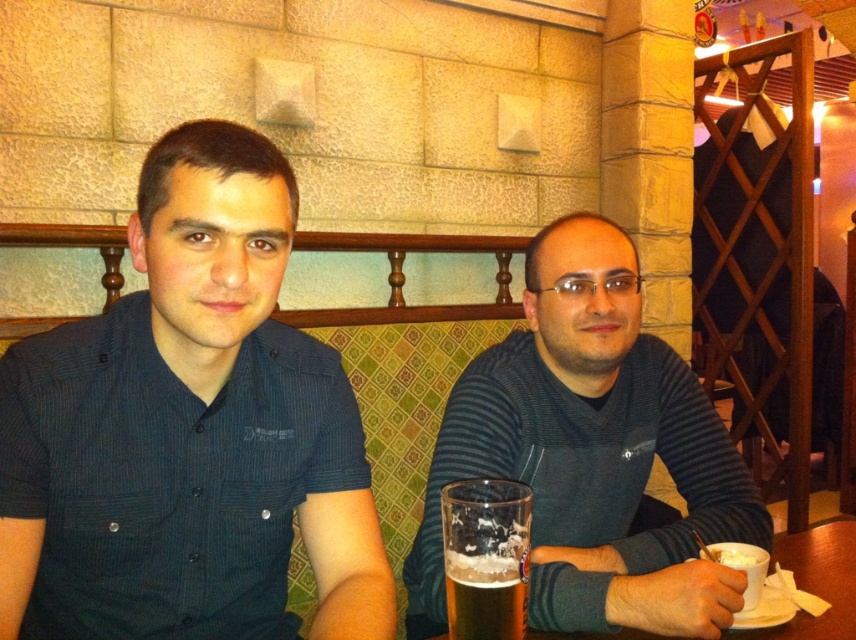
Question: Is foamy golden beer at lower center above foamy glass beer at lower center?

Choices:
 (A) yes
 (B) no

Answer: (A)

Question: Estimate the real-world distances between objects in this image. Which object is closer to the dark gray sweater at center?

Choices:
 (A) foamy glass beer at lower center
 (B) foamy golden beer at lower center

Answer: (B)

Question: Can you confirm if dark gray sweater at center is positioned above wooden table at lower center?

Choices:
 (A) yes
 (B) no

Answer: (A)

Question: Estimate the real-world distances between objects in this image. Which object is farther from the wooden table at lower center?

Choices:
 (A) dark gray sweater at center
 (B) foamy golden beer at lower center

Answer: (B)

Question: Estimate the real-world distances between objects in this image. Which object is farther from the dark blue button-up shirt at center?

Choices:
 (A) foamy glass beer at lower center
 (B) foamy golden beer at lower center
 (C) wooden table at lower center

Answer: (C)

Question: Can you confirm if dark gray sweater at center is positioned below foamy golden beer at lower center?

Choices:
 (A) yes
 (B) no

Answer: (B)